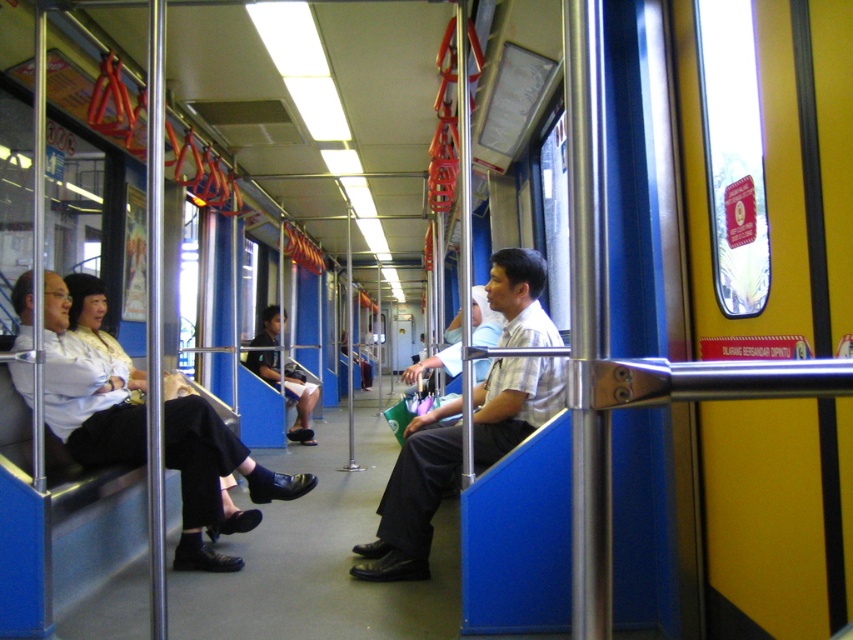
Question: Which of the following is the farthest from the observer?

Choices:
 (A) light brown fabric shirt at center
 (B) dark blue fabric skirt at center

Answer: (B)

Question: Can you confirm if matte white shirt at left is positioned below light brown fabric shirt at center?

Choices:
 (A) no
 (B) yes

Answer: (A)

Question: Among these objects, which one is nearest to the camera?

Choices:
 (A) matte white shirt at left
 (B) dark blue fabric skirt at center

Answer: (A)

Question: Which object appears farthest from the camera in this image?

Choices:
 (A) matte white shirt at left
 (B) dark blue fabric skirt at center

Answer: (B)

Question: From the image, what is the correct spatial relationship of light brown fabric shirt at center in relation to dark blue fabric skirt at center?

Choices:
 (A) below
 (B) above

Answer: (B)

Question: Can you confirm if matte white shirt at left is bigger than dark blue fabric skirt at center?

Choices:
 (A) yes
 (B) no

Answer: (A)